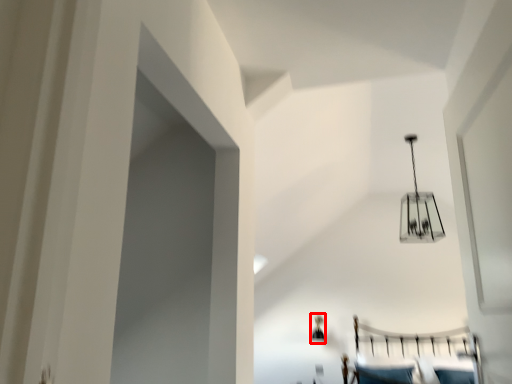
Question: From the image's perspective, where is lamp (annotated by the red box) located relative to lamp?

Choices:
 (A) above
 (B) below

Answer: (B)